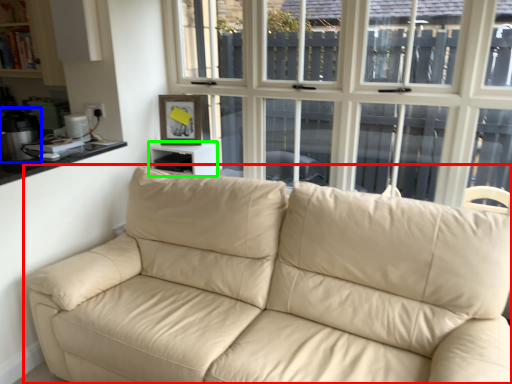
Question: Based on their relative distances, which object is nearer to studio couch (highlighted by a red box)? Choose from appliance (highlighted by a blue box) and table (highlighted by a green box).

Choices:
 (A) appliance
 (B) table

Answer: (B)